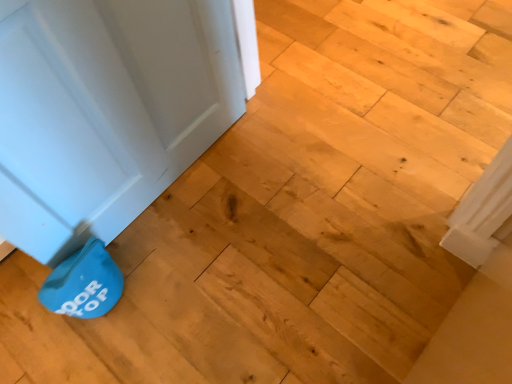
Find the location of a particular element. This screenshot has height=384, width=512. unoccupied region to the right of matte blue door at lower left is located at coordinates (273, 201).